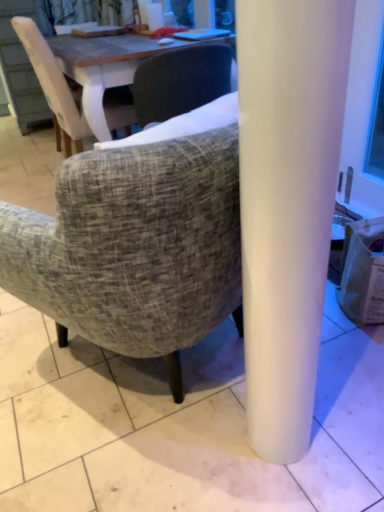
Question: Can you confirm if brown paper bag at lower right is thinner than textured fabric chair at center, the 1th chair from the front?

Choices:
 (A) yes
 (B) no

Answer: (A)

Question: Is brown paper bag at lower right not within textured fabric chair at center, placed as the second chair when sorted from left to right?

Choices:
 (A) no
 (B) yes

Answer: (B)

Question: Does brown paper bag at lower right have a larger size compared to textured fabric chair at center, placed as the second chair when sorted from left to right?

Choices:
 (A) no
 (B) yes

Answer: (A)

Question: From the image's perspective, is brown paper bag at lower right located beneath textured fabric chair at center, the 1th chair from the front?

Choices:
 (A) no
 (B) yes

Answer: (B)

Question: From a real-world perspective, is brown paper bag at lower right physically below textured fabric chair at center, which is the 2th chair from top to bottom?

Choices:
 (A) yes
 (B) no

Answer: (A)

Question: From a real-world perspective, is brown paper bag at lower right above or below light brown fabric chair at upper left, the 2th chair in the front-to-back sequence?

Choices:
 (A) below
 (B) above

Answer: (A)

Question: In terms of size, does brown paper bag at lower right appear bigger or smaller than light brown fabric chair at upper left, which appears as the 1th chair when viewed from the left?

Choices:
 (A) small
 (B) big

Answer: (A)

Question: In terms of width, does brown paper bag at lower right look wider or thinner when compared to light brown fabric chair at upper left, which appears as the 1th chair when viewed from the left?

Choices:
 (A) wide
 (B) thin

Answer: (B)

Question: Would you say brown paper bag at lower right is to the left or to the right of light brown fabric chair at upper left, which appears as the 1th chair when viewed from the top, in the picture?

Choices:
 (A) right
 (B) left

Answer: (A)

Question: Relative to brown paper bag at lower right, is light brown fabric chair at upper left, the second chair positioned from the bottom, in front or behind?

Choices:
 (A) front
 (B) behind

Answer: (B)

Question: Considering the positions of light brown fabric chair at upper left, the second chair positioned from the bottom, and brown paper bag at lower right in the image, is light brown fabric chair at upper left, the second chair positioned from the bottom, wider or thinner than brown paper bag at lower right?

Choices:
 (A) wide
 (B) thin

Answer: (A)

Question: In the image, is light brown fabric chair at upper left, which appears as the 1th chair when viewed from the left, on the left side or the right side of brown paper bag at lower right?

Choices:
 (A) left
 (B) right

Answer: (A)

Question: From the image's perspective, relative to brown paper bag at lower right, is light brown fabric chair at upper left, which is the second chair from right to left, above or below?

Choices:
 (A) above
 (B) below

Answer: (A)

Question: In terms of size, does light brown fabric chair at upper left, the second chair positioned from the bottom, appear bigger or smaller than textured fabric chair at center, which is the second chair from back to front?

Choices:
 (A) small
 (B) big

Answer: (B)

Question: From the image's perspective, relative to textured fabric chair at center, the first chair ordered from the bottom, is light brown fabric chair at upper left, the second chair positioned from the bottom, above or below?

Choices:
 (A) above
 (B) below

Answer: (A)